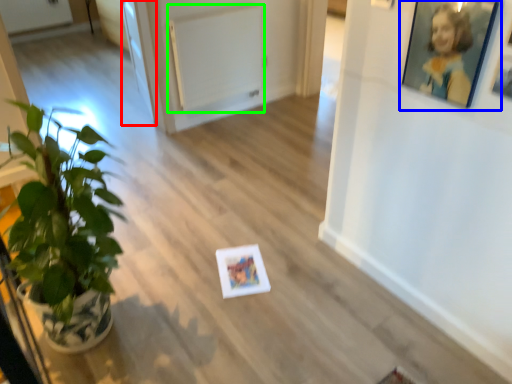
Question: Considering the real-world distances, which object is closest to glass door (highlighted by a red box)? picture frame (highlighted by a blue box) or radiator (highlighted by a green box).

Choices:
 (A) picture frame
 (B) radiator

Answer: (B)